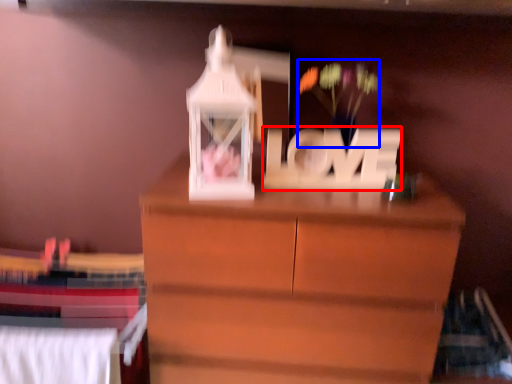
Question: Which object is further to the camera taking this photo, letter (highlighted by a red box) or floral arrangement (highlighted by a blue box)?

Choices:
 (A) letter
 (B) floral arrangement

Answer: (B)